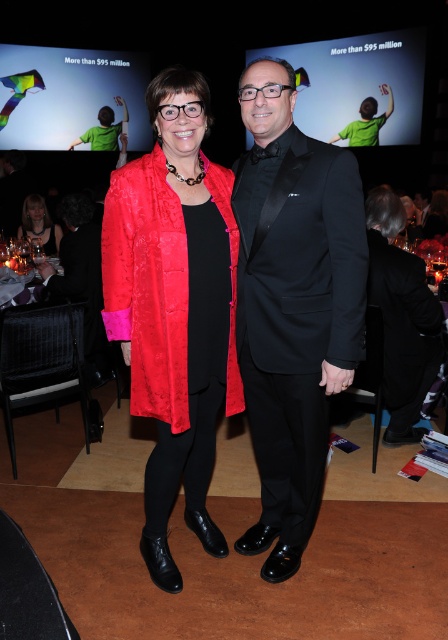
Describe the element at coordinates (366, 122) in the screenshot. I see `matte black suit at center` at that location.

Is point (370, 97) in front of point (43, 204)?

No, it is not.

I want to click on matte black suit at center, so click(x=366, y=122).

Can you confirm if black satin tuxedo at center is thinner than matte black suit at center?

Yes.

Can you confirm if black satin tuxedo at center is bigger than matte black suit at center?

No, black satin tuxedo at center is not bigger than matte black suit at center.

What do you see at coordinates (293, 305) in the screenshot?
I see `black satin tuxedo at center` at bounding box center [293, 305].

Where is `black satin tuxedo at center`? black satin tuxedo at center is located at coordinates (293, 305).

Is shiny red coat at center bigger than matte red dress at center?

Yes.

What do you see at coordinates (175, 307) in the screenshot? I see `shiny red coat at center` at bounding box center [175, 307].

Locate an element on the screen. The width and height of the screenshot is (448, 640). shiny red coat at center is located at coordinates (175, 307).